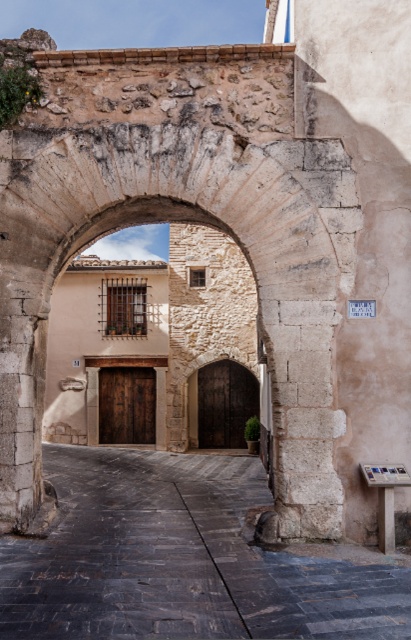
Question: Is stone archway at center bigger than dark stone alley at center?

Choices:
 (A) yes
 (B) no

Answer: (B)

Question: Is stone archway at center to the left of dark stone alley at center from the viewer's perspective?

Choices:
 (A) yes
 (B) no

Answer: (A)

Question: From the image, what is the correct spatial relationship of stone archway at center in relation to dark stone alley at center?

Choices:
 (A) left
 (B) right

Answer: (A)

Question: Among these points, which one is farthest from the camera?

Choices:
 (A) (336, 188)
 (B) (353, 589)

Answer: (A)